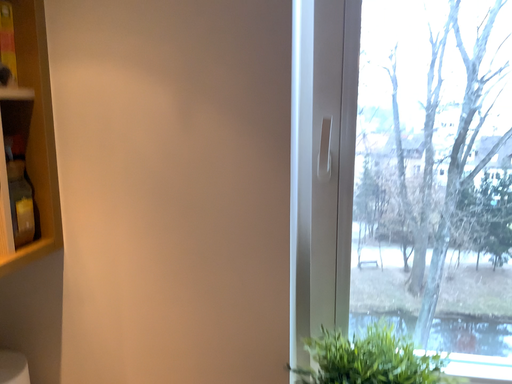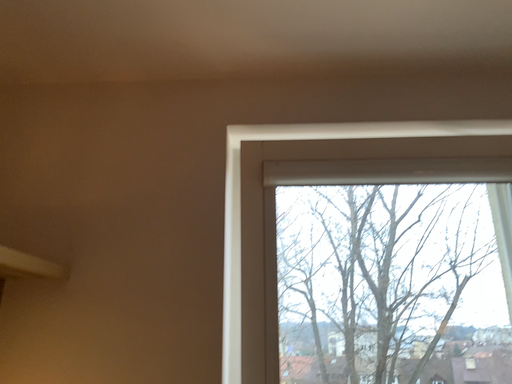
Question: Which way did the camera rotate in the video?

Choices:
 (A) rotated upward
 (B) rotated downward

Answer: (A)